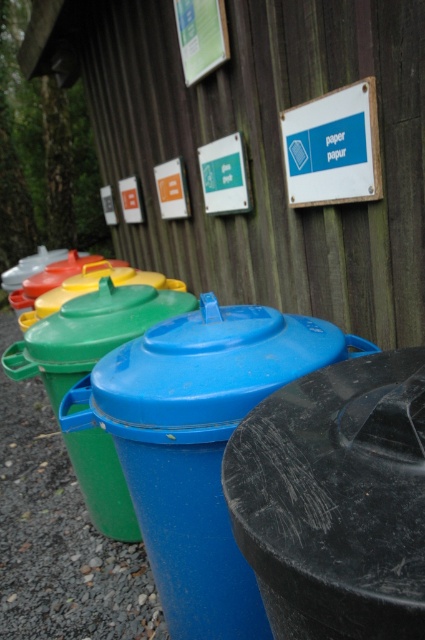
You are standing in front of the recycling bins and want to place a piece of paper in the correct bin. The blue plastic sign at upper center says to put paper there. However, the blue plastic bin at center is positioned to the left of the sign. Which bin should you use?

The blue plastic bin at center is to the left of the blue plastic sign at upper center, so you should use the blue plastic bin at center since the sign indicates it is for paper.

You are standing in front of the recycling bins and need to determine which point is closer to you. Which point is closer to your position? The points are point at (47, 528) and point at (142, 307).

Point at (47, 528) is closer to you because it is further to the camera than point at (142, 307).

You are standing in front of the recycling bins and want to check if the blue plastic sign at upper center is taller than the green matte lid at center. Based on the scene description, can you confirm this?

The blue plastic sign at upper center is shorter than the green matte lid at center, so it is not taller.